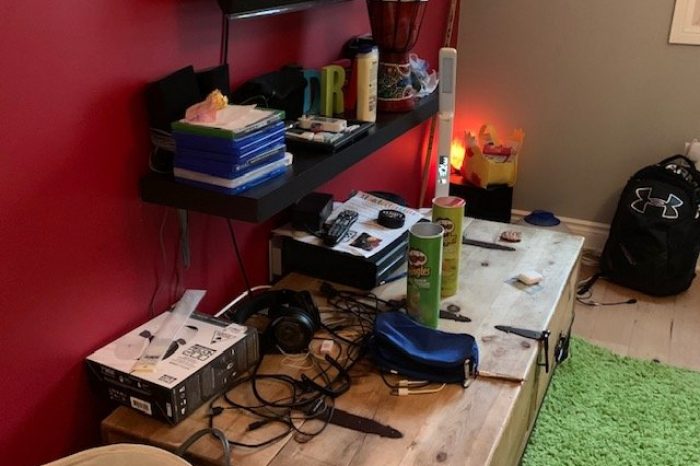
In order to click on tubes of pringles in this screenshot , I will do `click(427, 284)`, `click(454, 248)`.